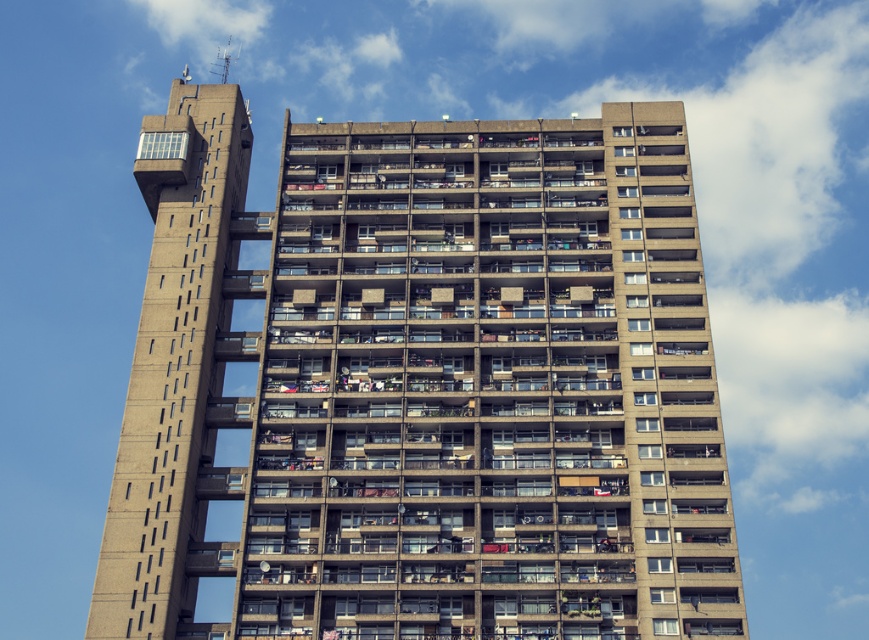
Question: Among these points, which one is farthest from the camera?

Choices:
 (A) (662, 618)
 (B) (116, 592)

Answer: (B)

Question: Is concrete building at center above concrete tower at upper left?

Choices:
 (A) yes
 (B) no

Answer: (B)

Question: From the image, what is the correct spatial relationship of concrete building at center in relation to concrete tower at upper left?

Choices:
 (A) right
 (B) left

Answer: (A)

Question: Which object is farther from the camera taking this photo?

Choices:
 (A) concrete tower at upper left
 (B) concrete building at center

Answer: (A)

Question: Does concrete building at center lie in front of concrete tower at upper left?

Choices:
 (A) no
 (B) yes

Answer: (B)